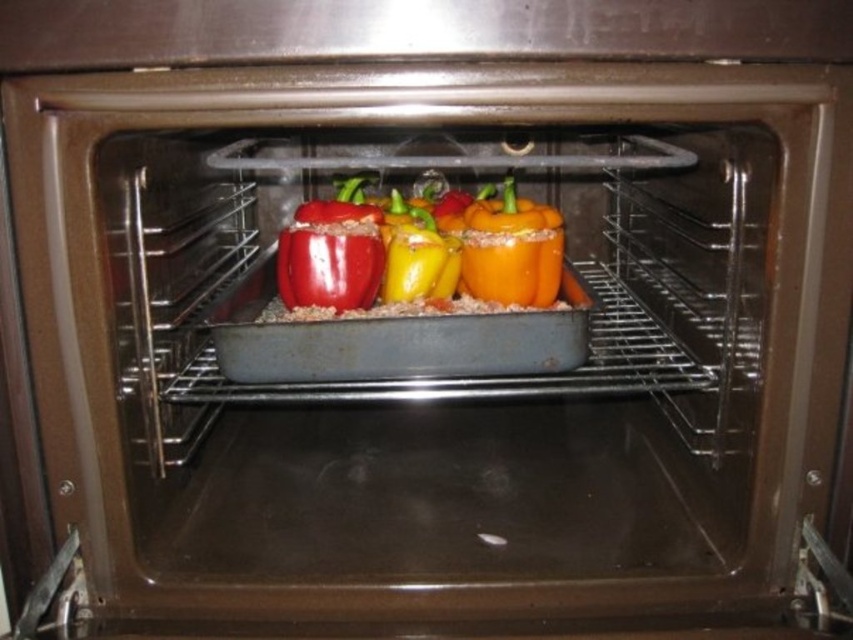
Question: Which point is closer to the camera taking this photo?

Choices:
 (A) (471, 275)
 (B) (386, 240)

Answer: (A)

Question: Observing the image, what is the correct spatial positioning of shiny red bell pepper at center in reference to orange matte bell pepper at center?

Choices:
 (A) right
 (B) left

Answer: (B)

Question: Can you confirm if shiny red bell pepper at center is bigger than orange matte bell pepper at center?

Choices:
 (A) no
 (B) yes

Answer: (B)

Question: Is shiny red bell pepper at center bigger than orange matte bell pepper at center?

Choices:
 (A) no
 (B) yes

Answer: (B)